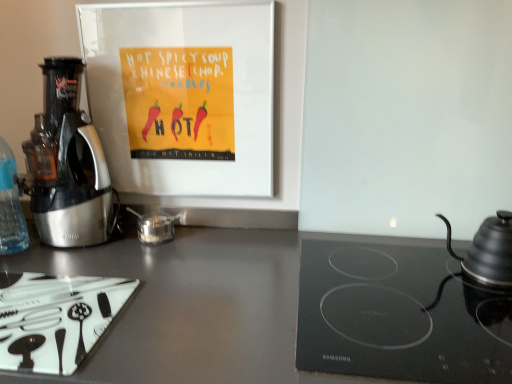
I want to click on free space that is to the left of black matte kettle at right, the first kitchen appliance from the right, so click(x=417, y=284).